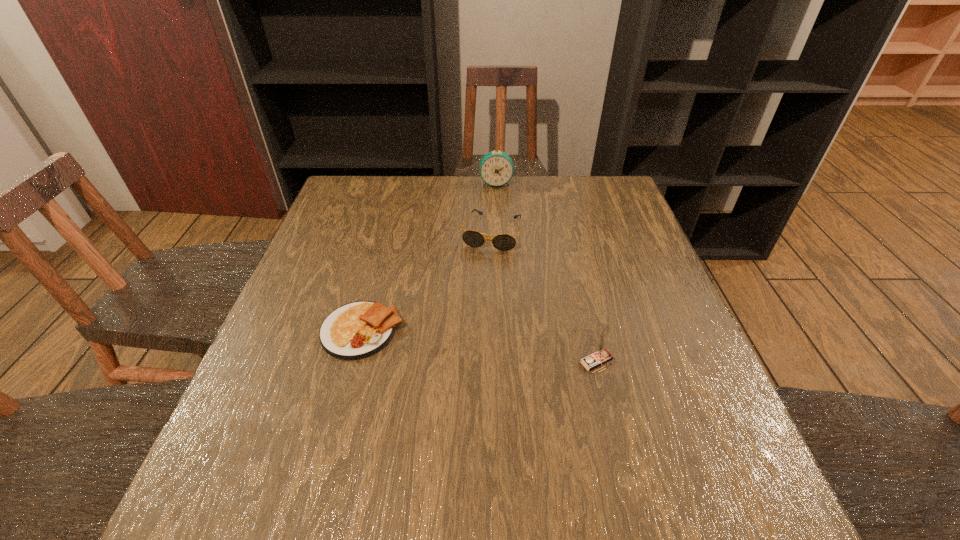
This screenshot has height=540, width=960. Find the location of `vacant space on the desktop that is between the omelet and the matchbox and is positioned on the front-facing side of the third nearest object`. vacant space on the desktop that is between the omelet and the matchbox and is positioned on the front-facing side of the third nearest object is located at coordinates (458, 343).

Locate an element on the screen. free spot on the desktop that is between the omelet and the matchbox and is positioned on the front-facing side of the farthest object is located at coordinates (500, 349).